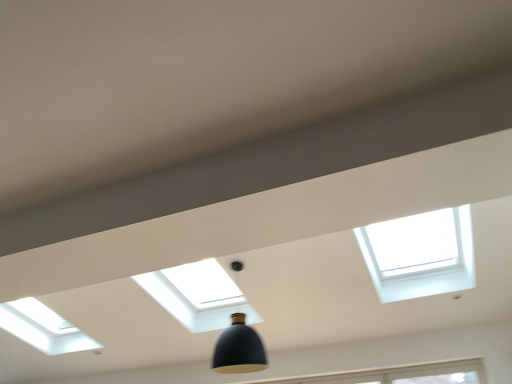
The height and width of the screenshot is (384, 512). Identify the location of matte black pendant light at center. (239, 349).

What is the approximate width of matte black pendant light at center?

It is 16.79 inches.

This screenshot has height=384, width=512. What do you see at coordinates (239, 349) in the screenshot?
I see `matte black pendant light at center` at bounding box center [239, 349].

This screenshot has height=384, width=512. What are the coordinates of `matte black pendant light at center` in the screenshot? It's located at (239, 349).